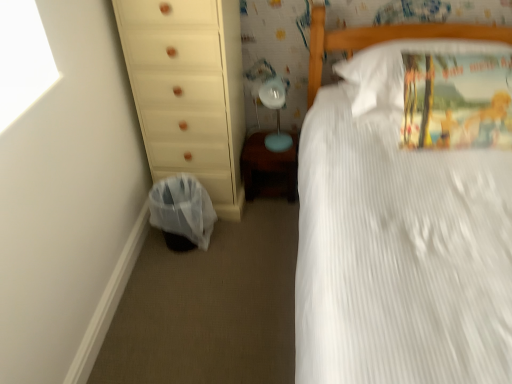
Question: Does white cotton pillow at upper right have a smaller size compared to white wood chest of drawers at left?

Choices:
 (A) no
 (B) yes

Answer: (B)

Question: Considering the relative sizes of white cotton pillow at upper right and white wood chest of drawers at left in the image provided, is white cotton pillow at upper right thinner than white wood chest of drawers at left?

Choices:
 (A) no
 (B) yes

Answer: (A)

Question: From the image's perspective, is white cotton pillow at upper right beneath white wood chest of drawers at left?

Choices:
 (A) yes
 (B) no

Answer: (B)

Question: Can you confirm if white cotton pillow at upper right is positioned to the right of white wood chest of drawers at left?

Choices:
 (A) yes
 (B) no

Answer: (A)

Question: Are white cotton pillow at upper right and white wood chest of drawers at left located far from each other?

Choices:
 (A) yes
 (B) no

Answer: (B)

Question: Does point (352, 66) appear closer or farther from the camera than point (169, 221)?

Choices:
 (A) closer
 (B) farther

Answer: (A)

Question: In terms of width, does white cotton pillow at upper right look wider or thinner when compared to plastic bag at lower left?

Choices:
 (A) thin
 (B) wide

Answer: (B)

Question: From a real-world perspective, is white cotton pillow at upper right positioned above or below plastic bag at lower left?

Choices:
 (A) below
 (B) above

Answer: (B)

Question: Based on their positions, is white cotton pillow at upper right located to the left or right of plastic bag at lower left?

Choices:
 (A) right
 (B) left

Answer: (A)

Question: Which is correct: matte blue table lamp at center is inside plastic bag at lower left, or outside of it?

Choices:
 (A) outside
 (B) inside

Answer: (A)

Question: In the image, is matte blue table lamp at center positioned in front of or behind plastic bag at lower left?

Choices:
 (A) behind
 (B) front

Answer: (A)

Question: Considering the positions of matte blue table lamp at center and plastic bag at lower left in the image, is matte blue table lamp at center taller or shorter than plastic bag at lower left?

Choices:
 (A) tall
 (B) short

Answer: (A)

Question: From a real-world perspective, is matte blue table lamp at center above or below plastic bag at lower left?

Choices:
 (A) above
 (B) below

Answer: (A)

Question: From a real-world perspective, is wooden changing table at lower center positioned above or below white cotton pillow at upper right?

Choices:
 (A) below
 (B) above

Answer: (A)

Question: From the image's perspective, is wooden changing table at lower center located above or below white cotton pillow at upper right?

Choices:
 (A) below
 (B) above

Answer: (A)